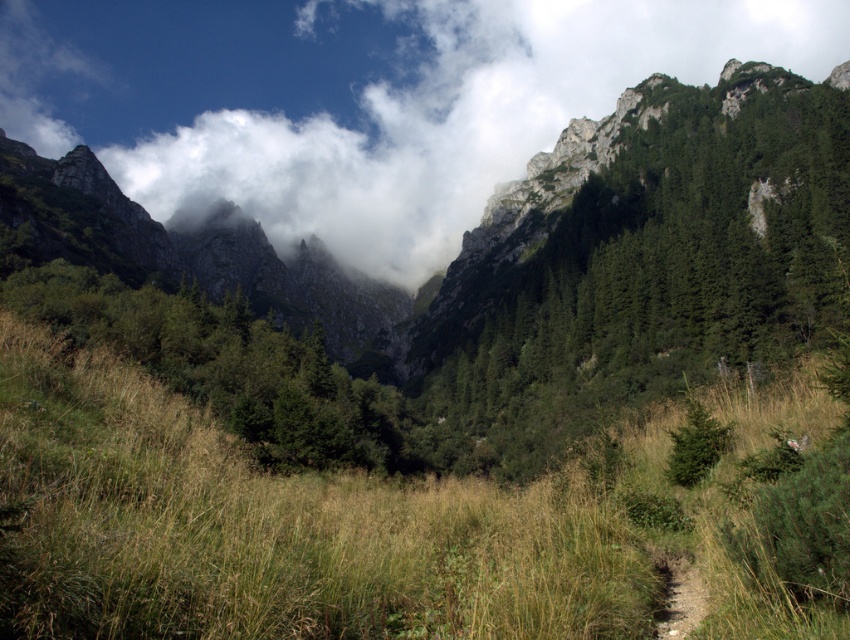
Does point (384, 616) come behind point (264, 166)?

No, (384, 616) is closer to viewer.

Who is more distant from viewer, (41, 612) or (364, 240)?

Point (364, 240)

Where is `green grassy at center`? green grassy at center is located at coordinates (354, 524).

In order to click on green grassy at center in this screenshot , I will do `click(354, 524)`.

Describe the element at coordinates (354, 524) in the screenshot. I see `green grassy at center` at that location.

Does green grassy at center have a larger size compared to brown dirt trail at lower right?

Indeed, green grassy at center has a larger size compared to brown dirt trail at lower right.

I want to click on green grassy at center, so click(x=354, y=524).

Does white fluffy cloud at upper center appear on the left side of brown dirt trail at lower right?

Indeed, white fluffy cloud at upper center is positioned on the left side of brown dirt trail at lower right.

Does white fluffy cloud at upper center have a greater height compared to brown dirt trail at lower right?

Indeed, white fluffy cloud at upper center has a greater height compared to brown dirt trail at lower right.

Between point (683, 6) and point (684, 609), which one is positioned in front?

Positioned in front is point (684, 609).

In order to click on white fluffy cloud at upper center in this screenshot , I will do `click(361, 99)`.